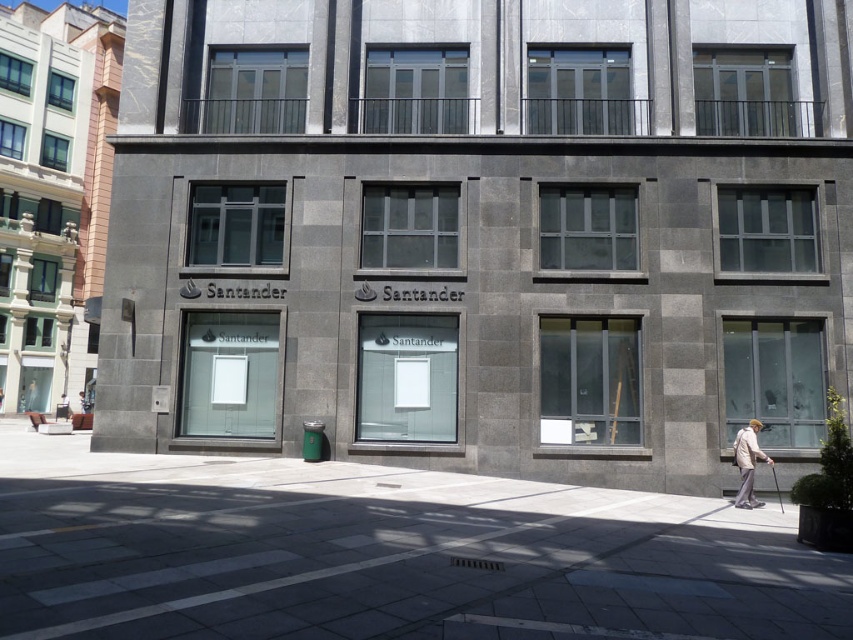
You are a delivery person standing in the plaza in front of the Santander bank branch. You need to place a package on the ground. The package is 1 meter tall. Can you place it between the light beige fabric coat at lower right and the white fabric at center without exceeding the height of either object?

The light beige fabric coat at lower right is taller than the white fabric at center. Since the package is 1 meter tall, you need to ensure it doesn not exceed the height of both objects. If the white fabric at center is shorter than the package, placing it there would not be possible. However, without specific height measurements for the objects, it is impossible to determine if the package will fit within the height constraints between them.

You are a delivery person standing in the plaza in front of the Santander bank branch. You see a light beige fabric coat at lower right and a white fabric at center. Which item is located to the right of the other?

The light beige fabric coat at lower right is positioned on the right side of white fabric at center.